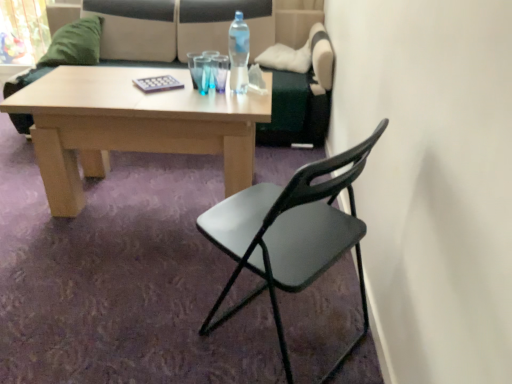
Where is `vacant space underneath black plastic chair at center (from a real-world perspective)`? vacant space underneath black plastic chair at center (from a real-world perspective) is located at coordinates point(272,330).